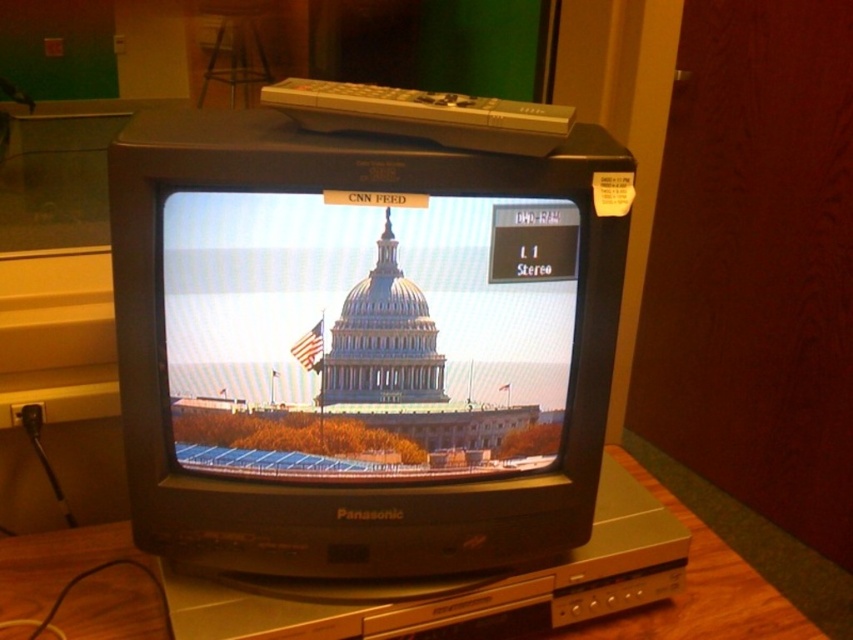
Based on the coordinates provided, which object is located at point (368, 332)?

The matte glass dome at center is located at point (368, 332).

You are standing 30 inches away from the vintage Panasonic CRT television. Can you reach the point at coordinates point (190, 196) on the television?

The distance of point (190, 196) from viewer is 31.38 inches, so you are 1.38 inches too far to reach it.

Based on the scene description, where is the matte glass dome at center located in terms of coordinates?

The matte glass dome at center is located at coordinates point (368,332).